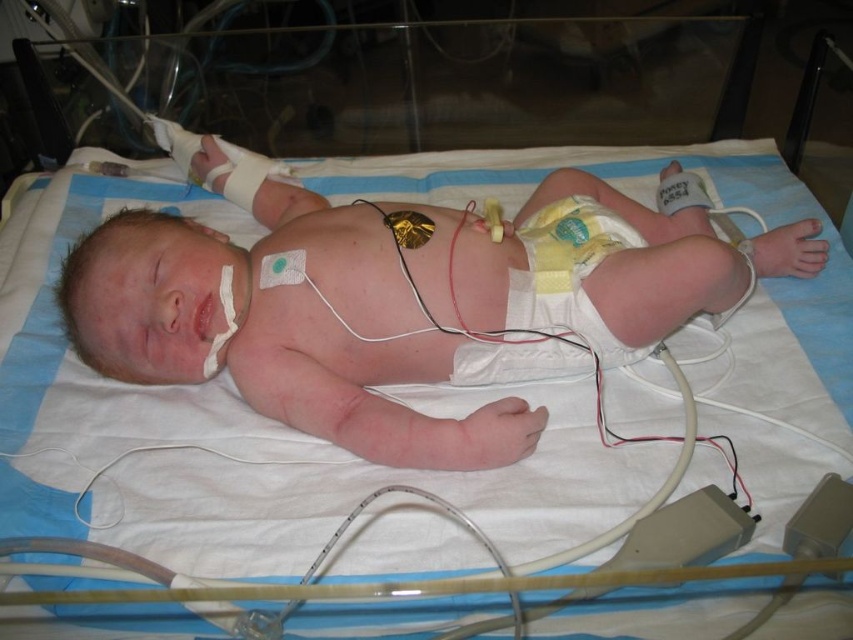
Is pink smooth skin at center thinner than yellow cloth diaper at center?

No.

Does pink smooth skin at center have a lesser height compared to yellow cloth diaper at center?

No.

Image resolution: width=853 pixels, height=640 pixels. What do you see at coordinates (399, 301) in the screenshot?
I see `pink smooth skin at center` at bounding box center [399, 301].

Locate an element on the screen. The image size is (853, 640). pink smooth skin at center is located at coordinates (399, 301).